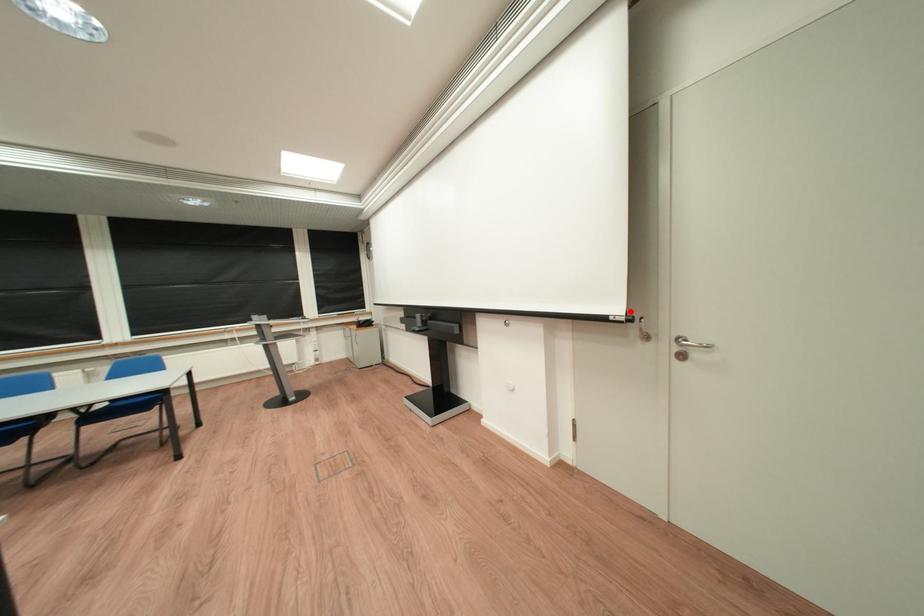
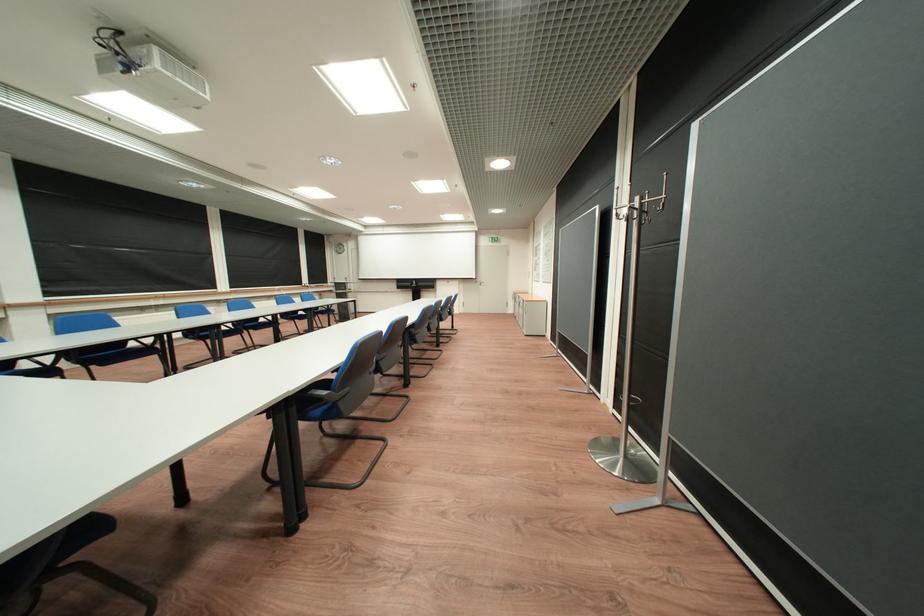
Find the pixel in the second image that matches the highlighted location in the first image.

(487, 278)